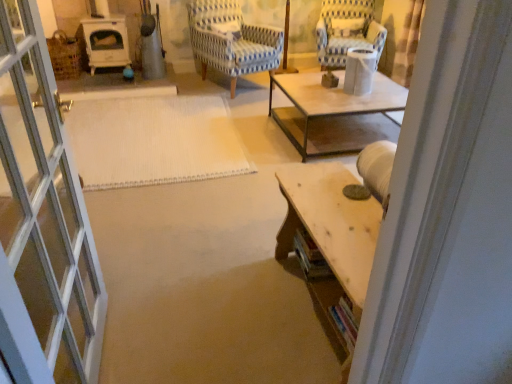
Question: In terms of height, does blue striped fabric chair at center, acting as the 2th chair starting from the right, look taller or shorter compared to blue and white striped fabric chair at upper right, the first chair from the right?

Choices:
 (A) tall
 (B) short

Answer: (A)

Question: Looking at the image, does blue striped fabric chair at center, which ranks as the first chair in left-to-right order, seem bigger or smaller compared to blue and white striped fabric chair at upper right, the first chair from the right?

Choices:
 (A) big
 (B) small

Answer: (A)

Question: Which object is the closest to the wooden table at lower right?

Choices:
 (A) blue and white striped fabric chair at upper right, the 2th chair when ordered from left to right
 (B) blue striped fabric chair at center, which ranks as the first chair in left-to-right order
 (C) white woven mat at center

Answer: (C)

Question: Considering the real-world distances, which object is closest to the blue striped fabric chair at center, which ranks as the first chair in left-to-right order?

Choices:
 (A) wooden table at lower right
 (B) white woven mat at center
 (C) blue and white striped fabric chair at upper right, the first chair from the right

Answer: (C)